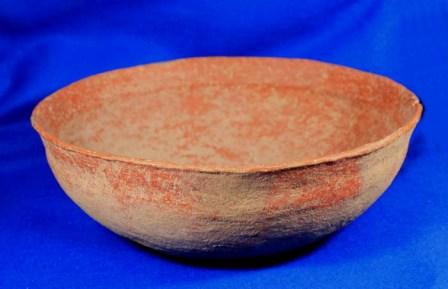
Find the location of a particular element. bowl is located at coordinates (294, 181).